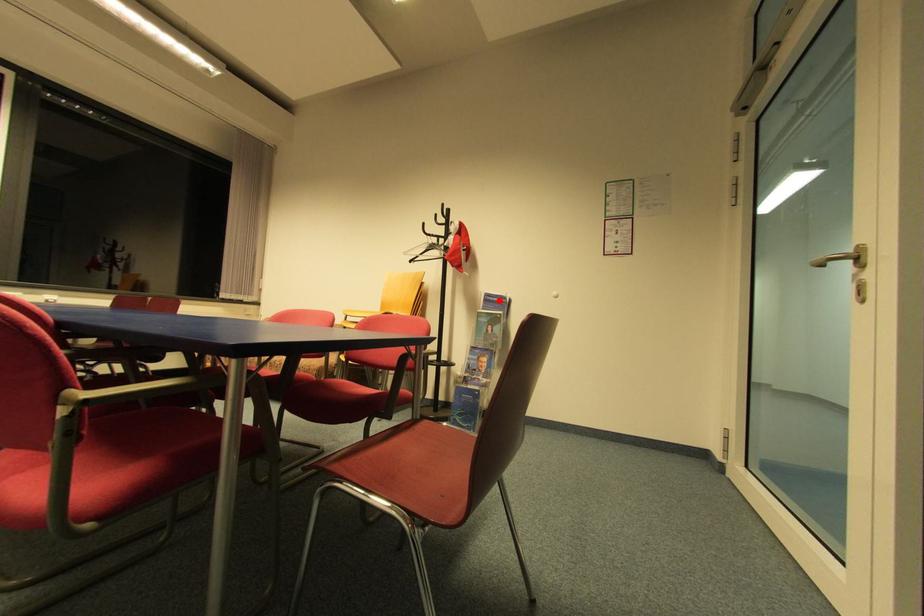
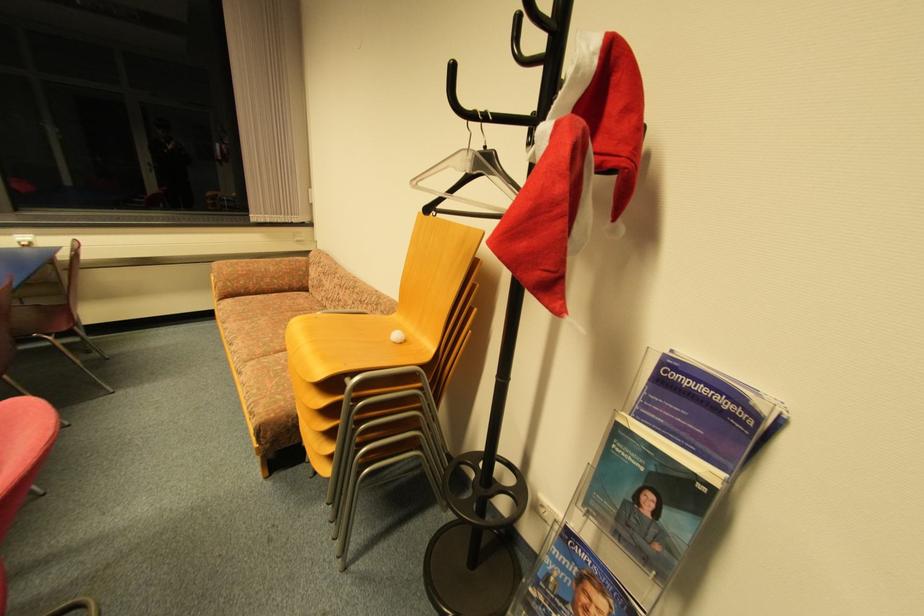
In the second image, find the point that corresponds to the highlighted location in the first image.

(708, 391)